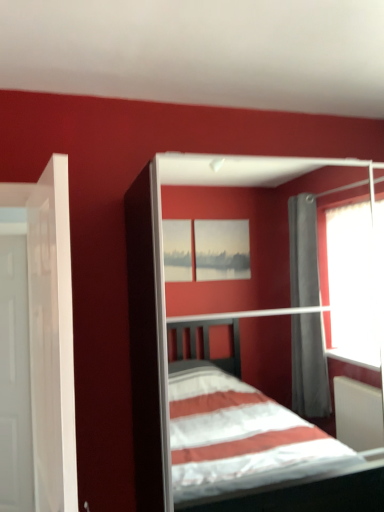
Question: From the image's perspective, does white matte bed at center appear higher than white glossy door at left, marked as the second door in a front-to-back arrangement?

Choices:
 (A) no
 (B) yes

Answer: (B)

Question: Is white matte bed at center placed right next to white glossy door at left, positioned as the 2th door in right-to-left order?

Choices:
 (A) no
 (B) yes

Answer: (A)

Question: Is white matte bed at center at the left side of white glossy door at left, acting as the 1th door starting from the left?

Choices:
 (A) no
 (B) yes

Answer: (A)

Question: Considering the relative sizes of white matte bed at center and white glossy door at left, positioned as the 2th door in right-to-left order, in the image provided, is white matte bed at center shorter than white glossy door at left, positioned as the 2th door in right-to-left order,?

Choices:
 (A) yes
 (B) no

Answer: (A)

Question: Is white matte bed at center outside of white glossy door at left, marked as the second door in a front-to-back arrangement?

Choices:
 (A) no
 (B) yes

Answer: (B)

Question: Is white glossy door at left, marked as the second door in a front-to-back arrangement, bigger or smaller than white matte bed at center?

Choices:
 (A) big
 (B) small

Answer: (B)

Question: Is white glossy door at left, acting as the 1th door starting from the left, inside the boundaries of white matte bed at center, or outside?

Choices:
 (A) outside
 (B) inside

Answer: (A)

Question: From the image's perspective, is white glossy door at left, marked as the second door in a front-to-back arrangement, located above or below white matte bed at center?

Choices:
 (A) below
 (B) above

Answer: (A)

Question: Considering the positions of point (21, 421) and point (152, 264), is point (21, 421) closer or farther from the camera than point (152, 264)?

Choices:
 (A) farther
 (B) closer

Answer: (A)

Question: Is white matte bed at center spatially inside white glossy door at left, marked as the second door in a front-to-back arrangement, or outside of it?

Choices:
 (A) inside
 (B) outside

Answer: (B)

Question: Visually, is white matte bed at center positioned to the left or to the right of white glossy door at left, acting as the 1th door starting from the left?

Choices:
 (A) right
 (B) left

Answer: (A)

Question: Does point (142, 303) appear closer or farther from the camera than point (11, 429)?

Choices:
 (A) closer
 (B) farther

Answer: (A)

Question: Is white matte bed at center taller or shorter than white glossy door at left, the first door positioned from the back?

Choices:
 (A) short
 (B) tall

Answer: (A)

Question: From a real-world perspective, is white glossy door at left, which is counted as the 1th door, starting from the front, above or below white glossy door at left, marked as the second door in a front-to-back arrangement?

Choices:
 (A) below
 (B) above

Answer: (B)

Question: In the image, is white glossy door at left, which is counted as the 1th door, starting from the front, on the left side or the right side of white glossy door at left, the first door positioned from the back?

Choices:
 (A) right
 (B) left

Answer: (A)